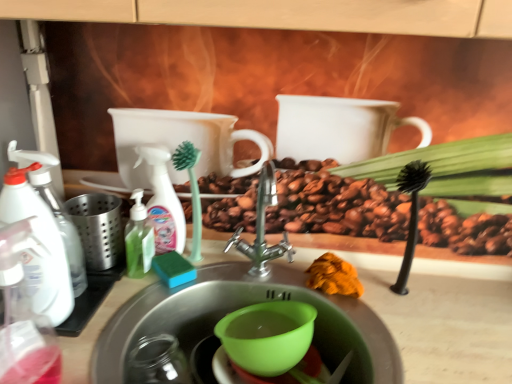
What are the coordinates of `unoccupied region to the right of white plastic spray bottle at left, the 3th cleaning product from the right` in the screenshot? It's located at (111, 311).